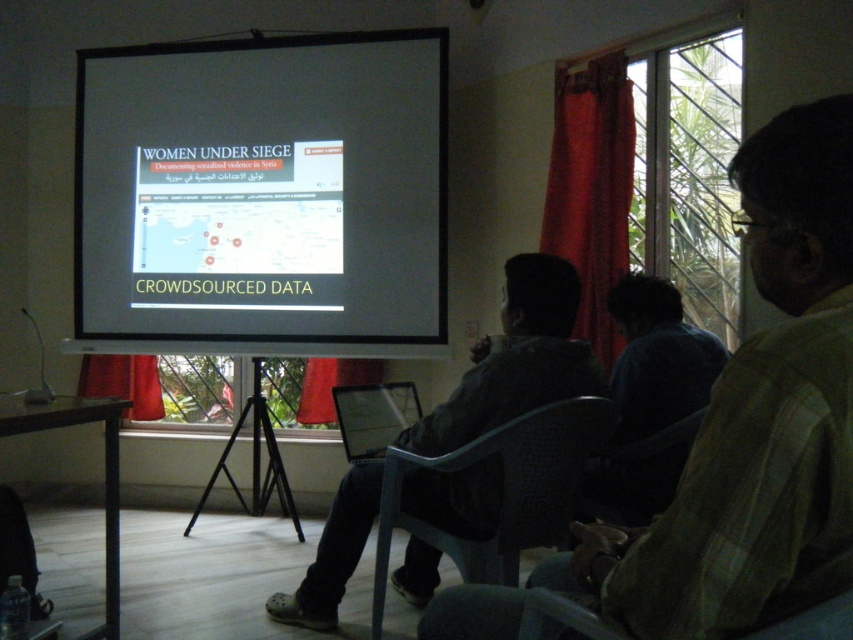
You are organizing a small workshop and need to determine seating arrangements. Given the gray plastic chair at lower right and the red fabric curtain at left, which object is wider?

The gray plastic chair at lower right is narrower than the red fabric curtain at left, so the red fabric curtain at left is wider.

Based on the scene description, what object is located at the coordinates point (262, 195)?

The white matte projection screen at center is located at point (262, 195).

You are an attendee at the presentation. You notice the plastic at center and the red velvet curtain at upper right. Which object is closer to you in the room?

The plastic at center is closer to you because it is in front of the red velvet curtain at upper right.